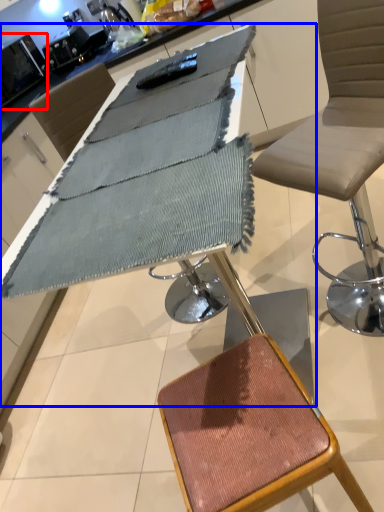
Question: Which of the following is the farthest to the observer, appliance (highlighted by a red box) or table (highlighted by a blue box)?

Choices:
 (A) appliance
 (B) table

Answer: (A)